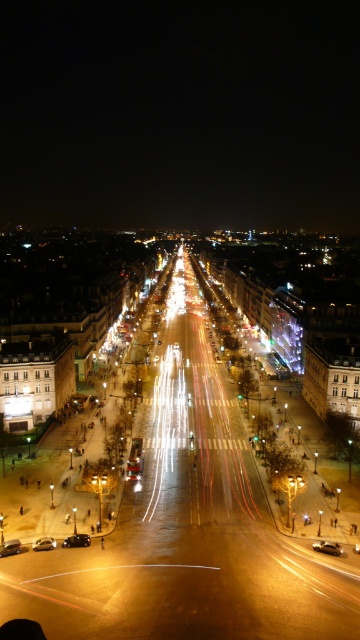
You are standing on a bridge overlooking the street. You see a shiny black car at center and a shiny black car at lower left. Which car is closer to you?

The shiny black car at center is closer to you because it is further to the viewer than the shiny black car at lower left.

You are a photographer standing on a bridge overlooking the urban street. You notice two cars below you, a shiny metallic car at center and a shiny silver car at center. Which car is positioned lower in the scene?

The shiny metallic car at center is located below the shiny silver car at center, so it is positioned lower in the scene.

You are standing on an elevated platform overlooking the urban street. You notice two points marked in the image. The first point is at coordinates point (330,545) and the second is at point (37,540). Which point is closer to your current position?

Point (330,545) is closer to the viewer than point (37,540).